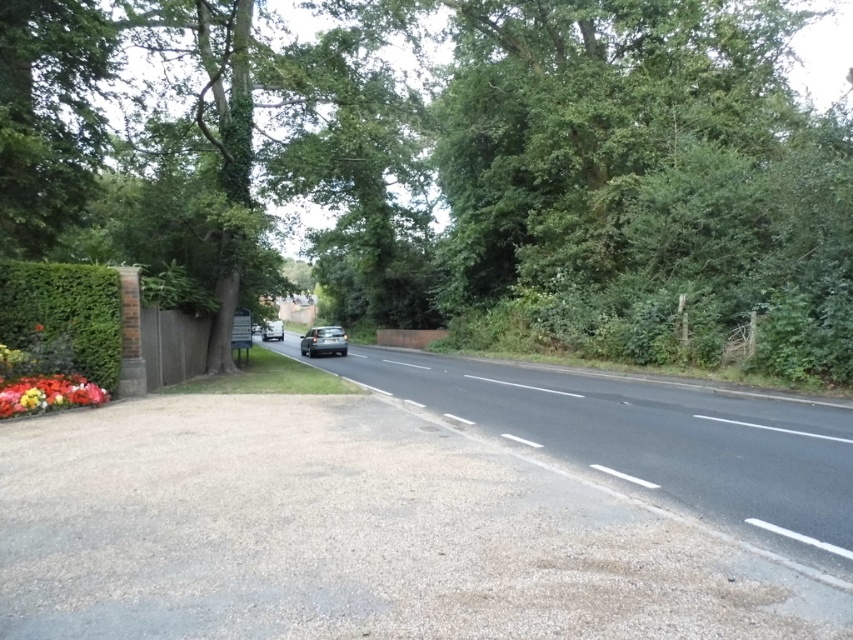
Does black asphalt road at center appear on the right side of silver metallic car at center?

Yes, black asphalt road at center is to the right of silver metallic car at center.

Which is behind, point (585, 381) or point (271, 321)?

Point (271, 321)

Locate an element on the screen. This screenshot has width=853, height=640. black asphalt road at center is located at coordinates (648, 440).

Does green leafy tree at center come behind green leafy hedge at left?

Yes, it is behind green leafy hedge at left.

Is green leafy tree at center shorter than green leafy hedge at left?

In fact, green leafy tree at center may be taller than green leafy hedge at left.

This screenshot has width=853, height=640. What do you see at coordinates (453, 161) in the screenshot?
I see `green leafy tree at center` at bounding box center [453, 161].

The image size is (853, 640). I want to click on green leafy tree at center, so click(x=453, y=161).

Does gravel driveway at lower left appear on the right side of silver metallic car at center?

Yes, gravel driveway at lower left is to the right of silver metallic car at center.

Is point (616, 589) behind point (271, 326)?

No, it is not.

Find the location of a particular element. gravel driveway at lower left is located at coordinates (355, 534).